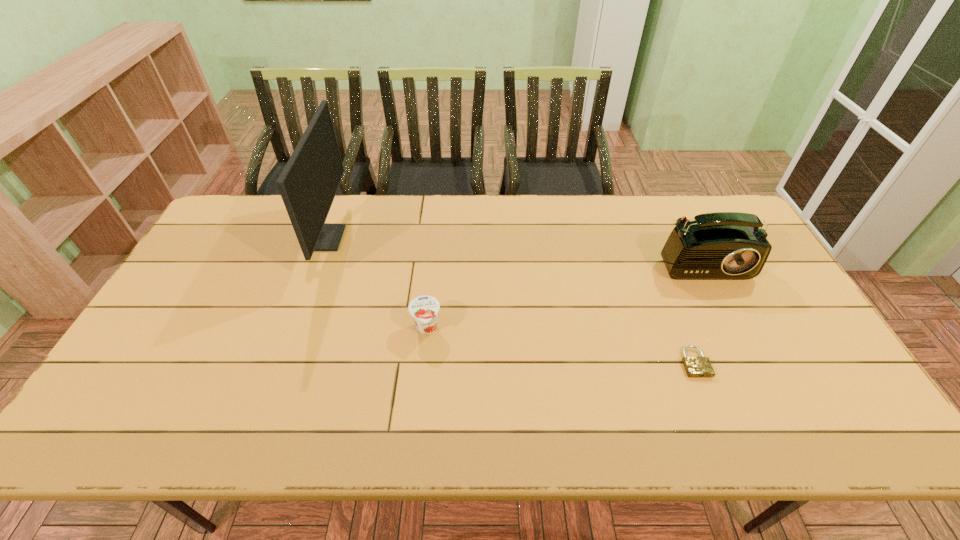
This screenshot has width=960, height=540. Identify the location of vacant area situated on the keyhole side of the nearest object. (717, 420).

At what (x,y) coordinates should I click in order to perform the action: click on computer monitor located in the far edge section of the desktop. Please return your answer as a coordinate pair (x, y). The image size is (960, 540). Looking at the image, I should click on (308, 184).

This screenshot has height=540, width=960. I want to click on radio receiver located at the far edge, so click(x=723, y=245).

Where is `object situated at the right edge`? The width and height of the screenshot is (960, 540). object situated at the right edge is located at coordinates (723, 245).

Locate an element on the screen. The height and width of the screenshot is (540, 960). object present at the far right corner is located at coordinates (723, 245).

Locate an element on the screen. Image resolution: width=960 pixels, height=540 pixels. free space at the far edge of the desktop is located at coordinates (504, 205).

The width and height of the screenshot is (960, 540). In order to click on free space at the near edge in this screenshot , I will do `click(647, 416)`.

Identify the location of vacant space at the left edge of the desktop. (114, 406).

What are the coordinates of `blank space at the near left corner of the desktop` in the screenshot? It's located at (157, 431).

I want to click on free space between the second shortest object and the radio receiver, so click(562, 289).